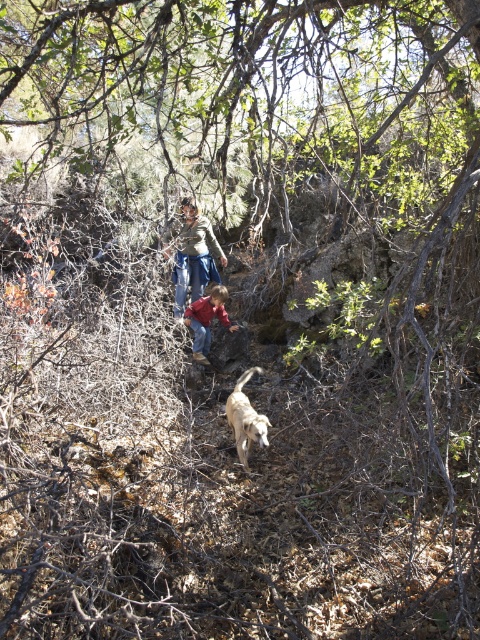
Question: Which point is closer to the camera?

Choices:
 (A) (233, 428)
 (B) (206, 298)

Answer: (A)

Question: Which object appears closest to the camera in this image?

Choices:
 (A) golden fur dog at center
 (B) red cotton shirt at center
 (C) denim skirt at center

Answer: (A)

Question: Is denim skirt at center bigger than golden fur dog at center?

Choices:
 (A) no
 (B) yes

Answer: (B)

Question: Does golden fur dog at center appear on the right side of red cotton shirt at center?

Choices:
 (A) no
 (B) yes

Answer: (B)

Question: Among these objects, which one is nearest to the camera?

Choices:
 (A) golden fur dog at center
 (B) denim skirt at center
 (C) red cotton shirt at center

Answer: (A)

Question: In this image, where is denim skirt at center located relative to golden fur dog at center?

Choices:
 (A) right
 (B) left

Answer: (B)